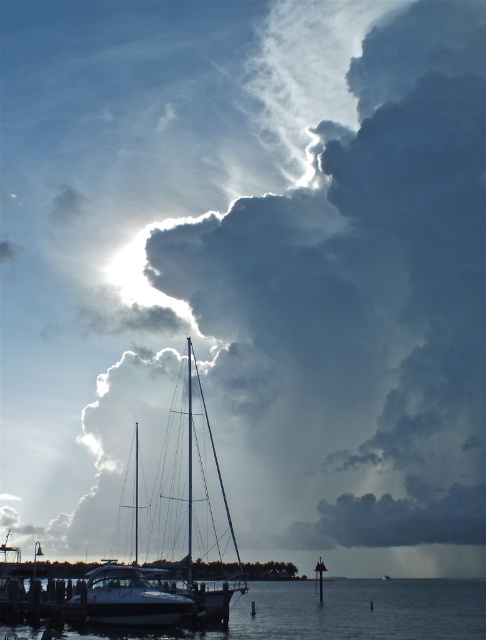
You are a photographer standing on the pier and want to capture both the transparent water at lower center and the white glossy boat at lower center in the same frame. Your camera has a maximum focal length that allows capturing objects up to 40 meters apart. Will you be able to include both objects in a single photo?

The transparent water at lower center and the white glossy boat at lower center are 40.11 meters apart from each other. Since the camera can only capture up to 40 meters, you will not be able to include both objects in a single photo.

In the scene shown: You are a photographer trying to capture the reflection of the dramatic sky in the transparent water at lower center. Based on the coordinates provided, where should you position your camera to ensure the reflection is centered in your shot?

To capture the reflection of the dramatic sky in the transparent water at lower center, position your camera at coordinates approximately 0.958 on the x and 0.702 on the y axis, as this is where the transparent water at lower center is located according to the description.

You are standing on the pier and see the transparent water at lower center and the white glossy boat at lower center. Which object is positioned to the right side of the other?

The transparent water at lower center is to the right of the white glossy boat at lower center.